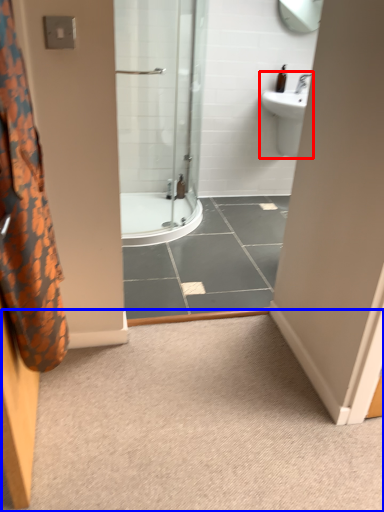
Question: Which point is closer to the camera, sink (highlighted by a red box) or plain (highlighted by a blue box)?

Choices:
 (A) sink
 (B) plain

Answer: (B)